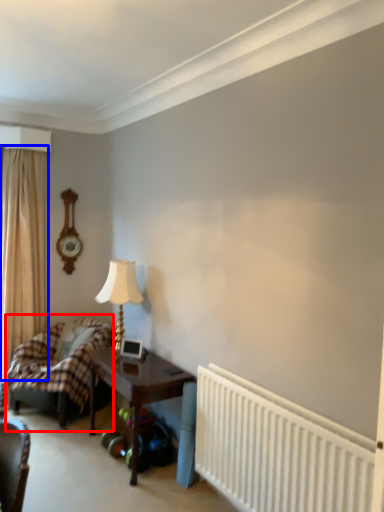
Question: Which object is further to the camera taking this photo, bed (highlighted by a red box) or curtain (highlighted by a blue box)?

Choices:
 (A) bed
 (B) curtain

Answer: (B)